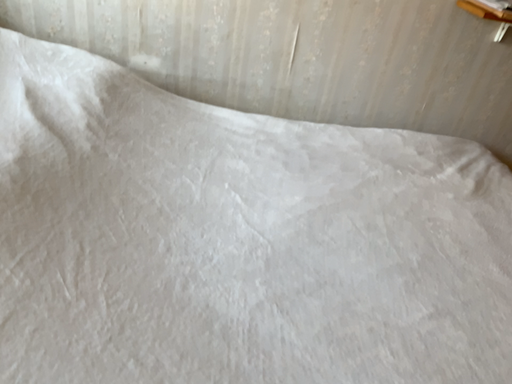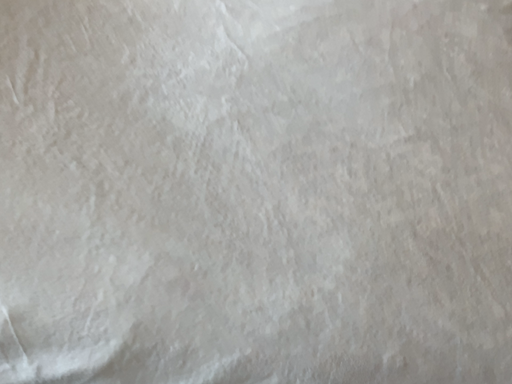
Question: How did the camera likely rotate when shooting the video?

Choices:
 (A) rotated downward
 (B) rotated upward

Answer: (A)